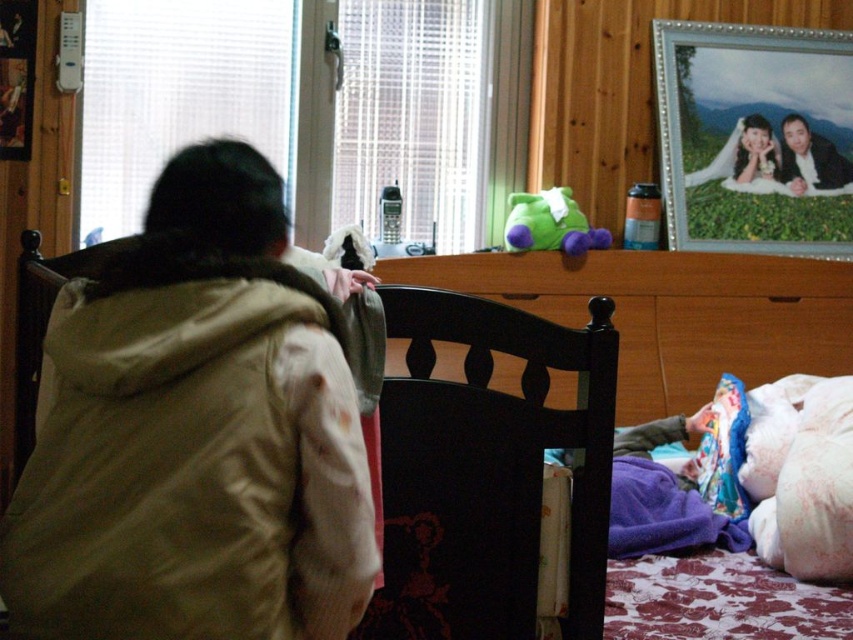
Question: Estimate the real-world distances between objects in this image. Which object is closer to the smooth black hair at upper right?

Choices:
 (A) green plush toy at upper center
 (B) beige fur-lined jacket at upper left
 (C) black wood bed at center

Answer: (C)

Question: Based on their relative distances, which object is nearer to the black wood bed at center?

Choices:
 (A) dark wood dresser at center
 (B) green plush toy at upper center
 (C) beige fur-lined jacket at upper left

Answer: (A)

Question: Considering the real-world distances, which object is closest to the green plush toy at upper center?

Choices:
 (A) smooth black hair at upper right
 (B) metallic silver picture frame at upper right
 (C) dark wood dresser at center

Answer: (C)

Question: Does beige fur-lined jacket at upper left have a lesser width compared to smooth black hair at upper right?

Choices:
 (A) no
 (B) yes

Answer: (A)

Question: In this image, where is black wood bed at center located relative to green plush toy at upper center?

Choices:
 (A) left
 (B) right

Answer: (B)

Question: Does dark wood dresser at center have a larger size compared to smooth black hair at upper right?

Choices:
 (A) no
 (B) yes

Answer: (B)